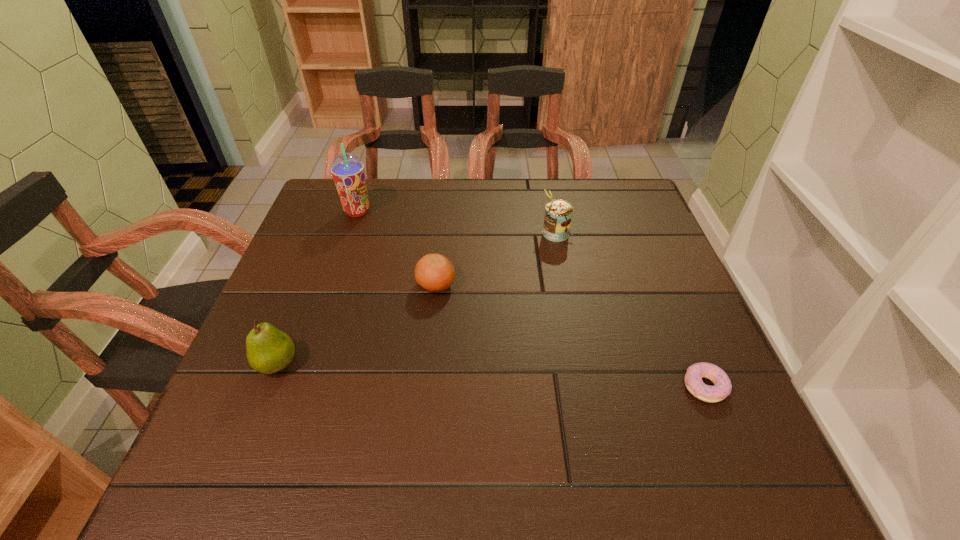
The width and height of the screenshot is (960, 540). What are the coordinates of `the tallest object` in the screenshot? It's located at (348, 172).

The height and width of the screenshot is (540, 960). I want to click on smoothie, so click(x=348, y=172).

This screenshot has width=960, height=540. I want to click on the second farthest object, so click(558, 213).

The height and width of the screenshot is (540, 960). Find the location of `the second object from right to left`. the second object from right to left is located at coordinates (558, 213).

Find the location of a particular element. This screenshot has height=540, width=960. pear is located at coordinates (269, 350).

The image size is (960, 540). Identify the location of the third farthest object. coord(434,272).

The height and width of the screenshot is (540, 960). Identify the location of clementine. (434, 272).

Locate an element on the screen. The image size is (960, 540). the shortest object is located at coordinates (722, 387).

The height and width of the screenshot is (540, 960). I want to click on doughnut, so click(x=722, y=387).

You are a GUI agent. You are given a task and a screenshot of the screen. Output one action in this format:
    pyautogui.click(x=<x>, y=<y>)
    Task: Click on the blank area located on the right of the farthest object
    This screenshot has width=960, height=540.
    Given the screenshot: What is the action you would take?
    pyautogui.click(x=408, y=212)